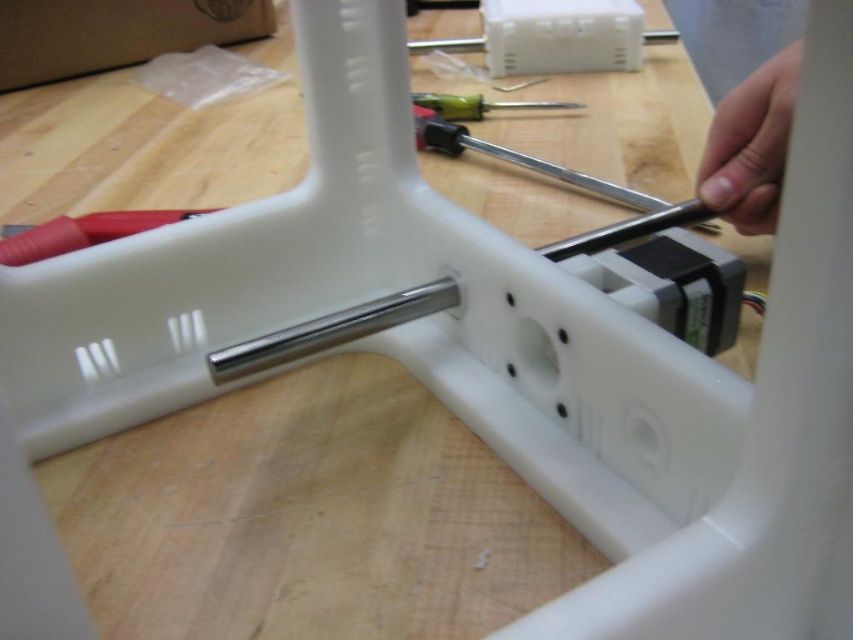
Question: Among these objects, which one is nearest to the camera?

Choices:
 (A) black plastic screwdriver at center
 (B) green plastic screwdriver at center

Answer: (A)

Question: Does smooth silver screwdriver at upper right have a smaller size compared to black plastic screwdriver at center?

Choices:
 (A) no
 (B) yes

Answer: (B)

Question: Considering the relative positions of smooth silver screwdriver at upper right and black plastic screwdriver at center in the image provided, where is smooth silver screwdriver at upper right located with respect to black plastic screwdriver at center?

Choices:
 (A) right
 (B) left

Answer: (A)

Question: Which point appears farthest from the camera in this image?

Choices:
 (A) (738, 156)
 (B) (425, 144)

Answer: (B)

Question: Can you confirm if black plastic screwdriver at center is positioned above green plastic screwdriver at center?

Choices:
 (A) yes
 (B) no

Answer: (B)

Question: Which of the following is the closest to the observer?

Choices:
 (A) (643, 198)
 (B) (724, 148)

Answer: (B)